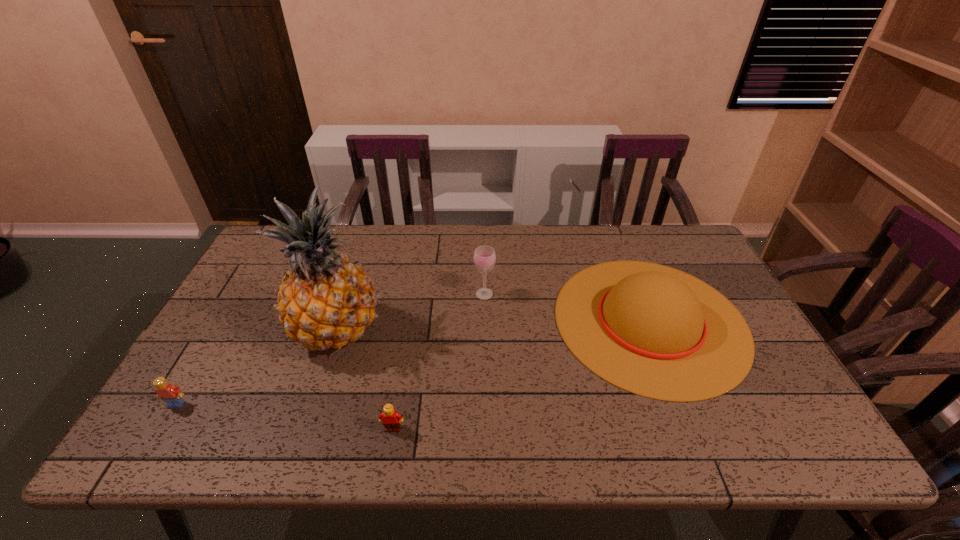
At what (x,y) coordinates should I click in order to perform the action: click on vacant area located on the front of the rightmost object. Please return your answer as a coordinate pair (x, y). Looking at the image, I should click on (695, 434).

Where is `free space located 0.110m on the front-facing side of the leftmost object`? free space located 0.110m on the front-facing side of the leftmost object is located at coordinates (147, 454).

This screenshot has width=960, height=540. Find the location of `object that is at the far edge`. object that is at the far edge is located at coordinates (652, 330).

Where is `object at the near edge`? object at the near edge is located at coordinates (391, 419).

This screenshot has width=960, height=540. I want to click on object that is positioned at the left edge, so click(172, 395).

This screenshot has width=960, height=540. I want to click on object that is at the right edge, so click(652, 330).

The height and width of the screenshot is (540, 960). Find the location of `object at the far right corner`. object at the far right corner is located at coordinates (652, 330).

The height and width of the screenshot is (540, 960). In the image, there is a desktop. Find the location of `free region at the far edge`. free region at the far edge is located at coordinates (405, 239).

Locate an element on the screen. The image size is (960, 540). vacant space at the near edge is located at coordinates (695, 442).

At what (x,y) coordinates should I click in order to perform the action: click on vacant space at the left edge of the desktop. Please return your answer as a coordinate pair (x, y). The height and width of the screenshot is (540, 960). Looking at the image, I should click on (269, 306).